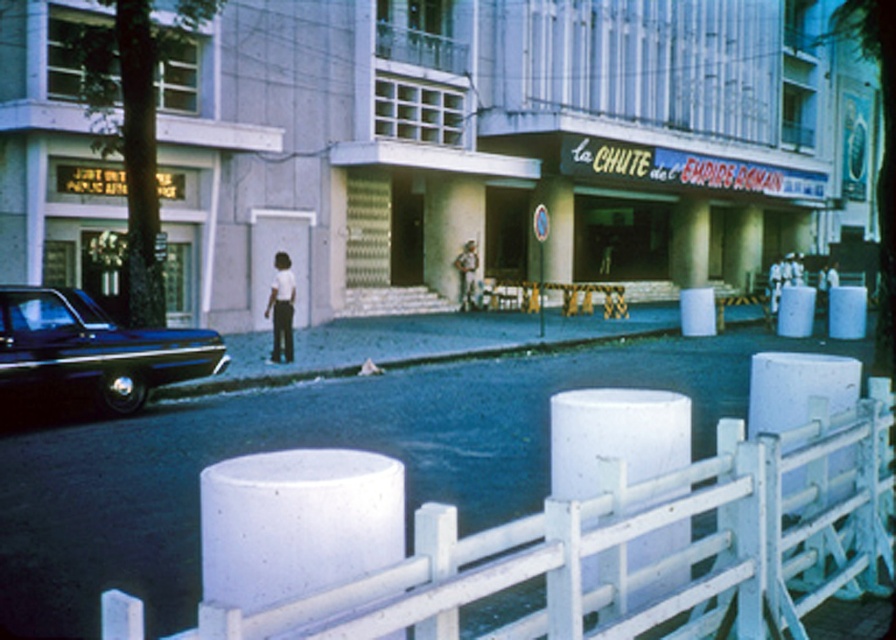
You are a delivery person trying to determine if your 1.8 meters tall package can be placed on the white concrete fence at lower center without it falling off. Considering the height of the shiny black sedan at left, can you estimate if the fence is tall enough?

The white concrete fence at lower center is not as tall as the shiny black sedan at left. Since the sedan is taller than the fence, the fence might not be tall enough to securely hold a 1.8 meters tall package without it tipping over.

You are standing at the point marked as point (x=281, y=308) in the image. What object is located exactly at that point?

The white matte pants at center are located exactly at point (x=281, y=308).

From the picture: You are a delivery person trying to navigate through the urban street scene. You need to place a large package between the white concrete fence at lower center and the camouflage fabric uniform at center. Which object should you place the package closer to so it doesn

The white concrete fence at lower center is bigger than the camouflage fabric uniform at center, so placing the package closer to the white concrete fence at lower center would provide a more stable and secure placement due to its larger size.